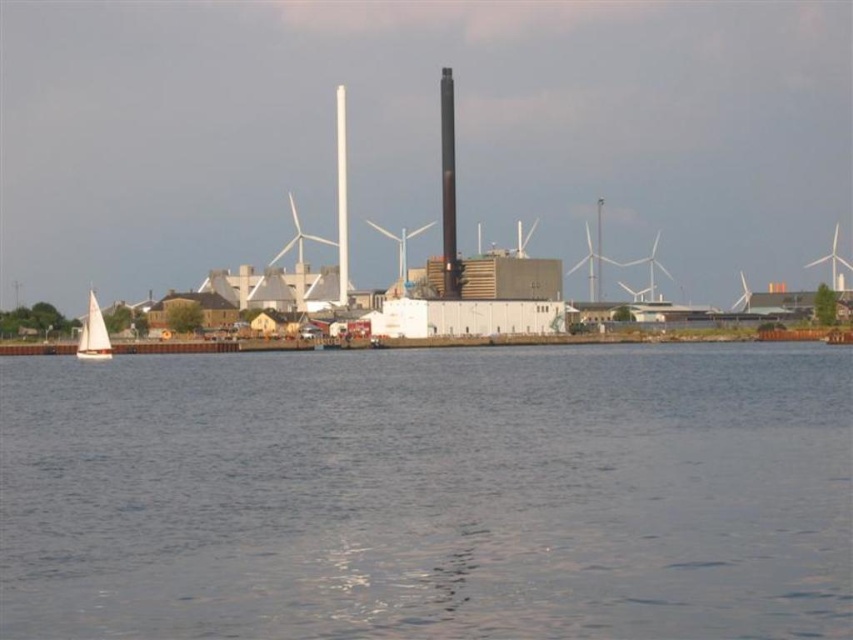
Can you confirm if transparent water at lower center is taller than white plastic windmill at upper right?

No, transparent water at lower center is not taller than white plastic windmill at upper right.

Can you confirm if transparent water at lower center is positioned above white plastic windmill at upper right?

Actually, transparent water at lower center is below white plastic windmill at upper right.

What do you see at coordinates (428, 493) in the screenshot?
I see `transparent water at lower center` at bounding box center [428, 493].

Where is `transparent water at lower center`? transparent water at lower center is located at coordinates (428, 493).

Which is in front, point (405, 266) or point (833, 240)?

Point (405, 266)

Between white plastic windmill at center and white plastic windmill at upper right, which one has less height?

white plastic windmill at upper right is shorter.

In order to click on white plastic windmill at center in this screenshot , I will do `click(401, 250)`.

Can you confirm if transparent water at lower center is bigger than white sailboat at left?

No.

Image resolution: width=853 pixels, height=640 pixels. Identify the location of transparent water at lower center. click(x=428, y=493).

The width and height of the screenshot is (853, 640). Find the location of `transparent water at lower center`. transparent water at lower center is located at coordinates (428, 493).